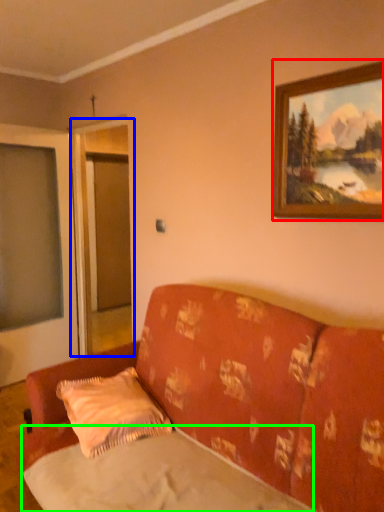
Question: Estimate the real-world distances between objects in this image. Which object is farther from picture frame (highlighted by a red box), screen door (highlighted by a blue box) or sheet (highlighted by a green box)?

Choices:
 (A) screen door
 (B) sheet

Answer: (A)